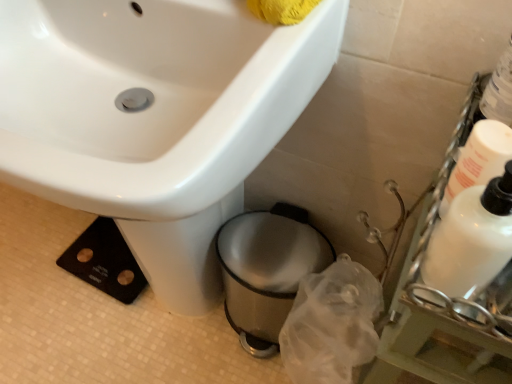
Identify the location of blank space situated above shiny metallic trash can at lower center (from a real-world perspective). [x=273, y=252].